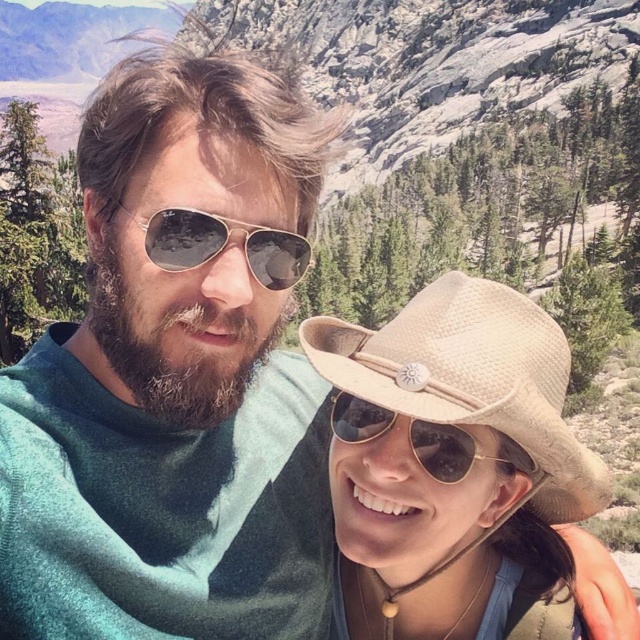
Which is more to the right, gold reflective aviator sunglasses at center or sunglasses at center?

sunglasses at center

Describe the element at coordinates (221, 244) in the screenshot. The image size is (640, 640). I see `gold reflective aviator sunglasses at center` at that location.

Image resolution: width=640 pixels, height=640 pixels. What are the coordinates of `gold reflective aviator sunglasses at center` in the screenshot? It's located at (221, 244).

Does beige straw cowboy hat at center lie in front of sunglasses at center?

Yes, it is in front of sunglasses at center.

Is beige straw cowboy hat at center positioned behind sunglasses at center?

That is False.

Between point (541, 368) and point (360, 419), which one is positioned behind?

Point (360, 419)

Identify the location of beige straw cowboy hat at center. (472, 378).

Is beige straw cowboy hat at center above gold reflective aviator sunglasses at center?

No.

Can you confirm if beige straw cowboy hat at center is thinner than gold reflective aviator sunglasses at center?

Incorrect, beige straw cowboy hat at center's width is not less than gold reflective aviator sunglasses at center's.

This screenshot has width=640, height=640. Identify the location of beige straw cowboy hat at center. (472, 378).

You are a GUI agent. You are given a task and a screenshot of the screen. Output one action in this format:
    pyautogui.click(x=<x>, y=<y>)
    Task: Click on the beige straw cowboy hat at center
    
    Given the screenshot: What is the action you would take?
    pyautogui.click(x=472, y=378)